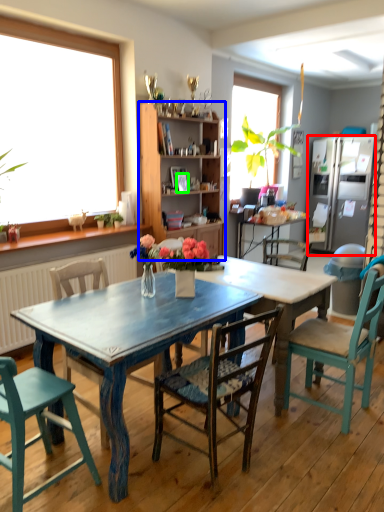
Question: Based on their relative distances, which object is nearer to refrigerator (highlighted by a red box)? Choose from cabinetry (highlighted by a blue box) and picture frame (highlighted by a green box).

Choices:
 (A) cabinetry
 (B) picture frame

Answer: (A)